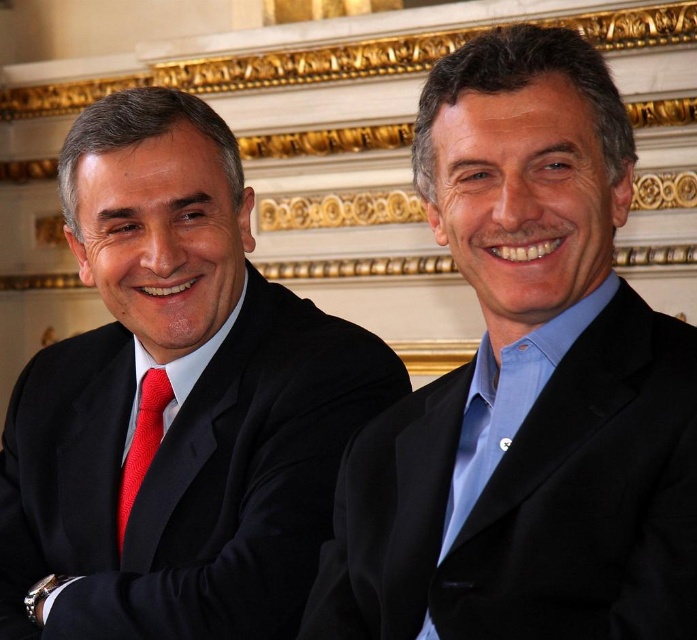
Question: Is the position of blue satin suit at right more distant than that of knitted red tie at left?

Choices:
 (A) no
 (B) yes

Answer: (A)

Question: Which point is closer to the camera?

Choices:
 (A) (526, 228)
 (B) (135, 484)
 (C) (3, 461)

Answer: (A)

Question: Is matte black suit at left above knitted red tie at left?

Choices:
 (A) yes
 (B) no

Answer: (A)

Question: Estimate the real-world distances between objects in this image. Which object is closer to the blue satin suit at right?

Choices:
 (A) knitted red tie at left
 (B) matte black suit at left

Answer: (B)

Question: Which of these objects is positioned closest to the knitted red tie at left?

Choices:
 (A) blue satin suit at right
 (B) matte black suit at left

Answer: (B)

Question: From the image, what is the correct spatial relationship of blue satin suit at right in relation to matte black suit at left?

Choices:
 (A) above
 (B) below

Answer: (A)